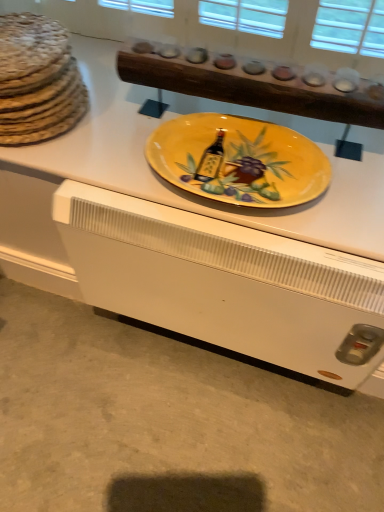
Image resolution: width=384 pixels, height=512 pixels. I want to click on free point above yellow glossy plate at center (from a real-world perspective), so 170,113.